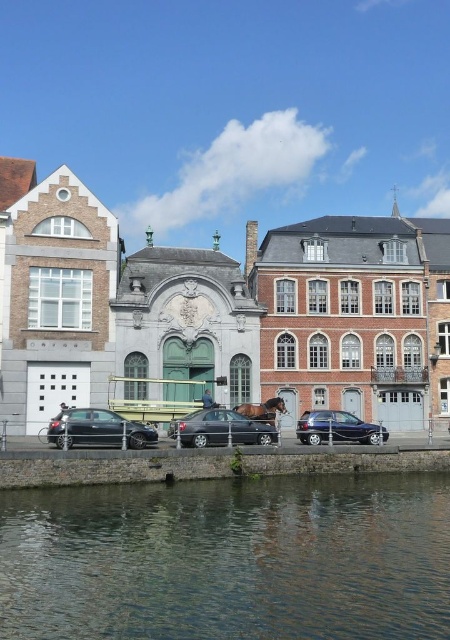
Looking at this image, you are a photographer planning to capture both the shiny black sedan at lower left and the brown glossy horse at center in a single frame. Considering their heights, which object should you position closer to the camera to ensure both are fully visible in the photo?

The shiny black sedan at lower left is much taller than the brown glossy horse at center. To ensure both are fully visible in the photo, position the shiny black sedan at lower left closer to the camera so its height is better accommodated within the frame.